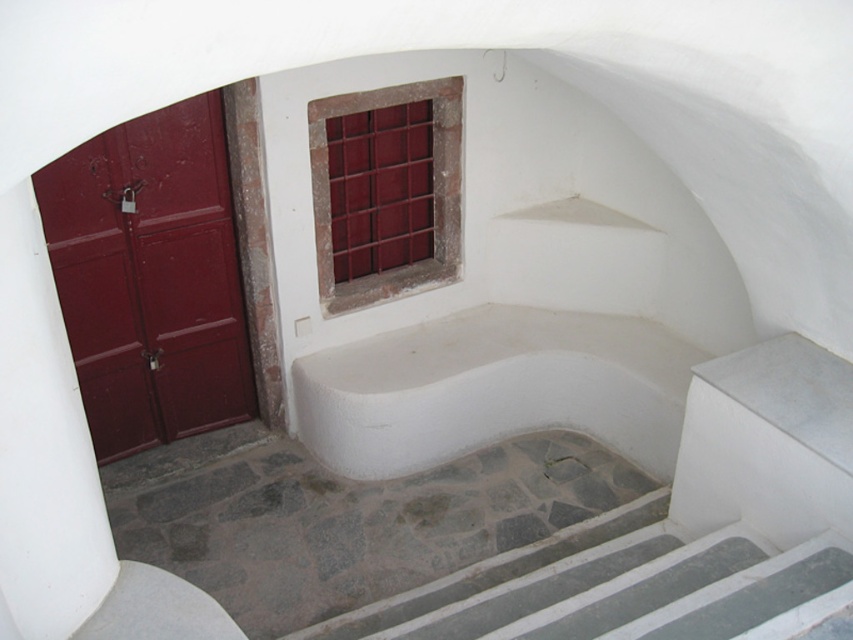
You are a delivery person standing at the bottom of the three concrete steps leading up to the matte red door at left. The package you are carrying requires you to be at least 3 meters away from the door to open it safely. Can you open the package here?

The distance between you and the matte red door at left is 3.73 meters, which is more than the required 3 meters. Therefore, you can safely open the package here.

You are a delivery person trying to reach the doorbell located on the matte red door at left. However, there is a maroon glass window at upper center above it. Can you reach the doorbell without climbing onto anything?

The matte red door at left is in front of the maroon glass window at upper center, so the doorbell on the matte red door at left should be accessible without needing to climb since the door is in front of the window.

You are a delivery person carrying a large package that requires a clear path to the maroon glass window at upper center. The gray stone stairs at lower center are in the way. Can you navigate around them to reach the window without moving the stairs?

The gray stone stairs at lower center and maroon glass window at upper center are 6.81 feet apart. Since the stairs are in the lower center and the window is above them, you can walk around the stairs to reach the window as long as there is enough space between them and other structures. However, the exact navigability depends on the surrounding area not described here.